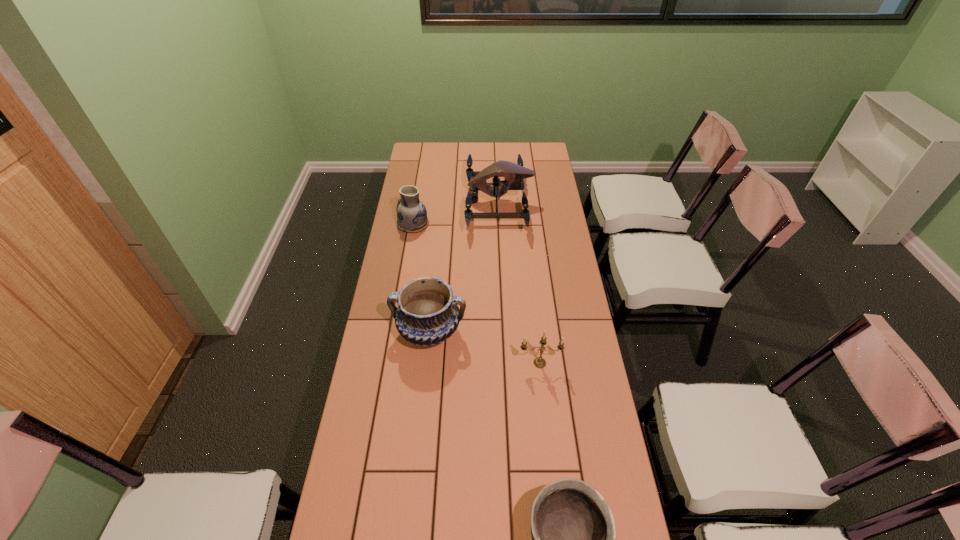
This screenshot has width=960, height=540. In order to click on the third closest object to the farthest pottery in this screenshot , I will do `click(539, 362)`.

Image resolution: width=960 pixels, height=540 pixels. Find the location of `the fourth closest object to the drone`. the fourth closest object to the drone is located at coordinates (573, 531).

Identify which pottery is located as the second nearest to the second farthest pottery. Please provide its 2D coordinates. Your answer should be formatted as a tuple, i.e. [(x, y)], where the tuple contains the x and y coordinates of a point satisfying the conditions above.

[(573, 531)]

The image size is (960, 540). In order to click on the second closest pottery to the second nearest pottery in this screenshot , I will do point(573,531).

The image size is (960, 540). Identify the location of vacant area that satisfies the following two spatial constraints: 1. on the front-facing side of the drone; 2. on the back side of the candle. tap(507, 363).

Where is `free space that satisfies the following two spatial constraints: 1. on the front-facing side of the drone; 2. on the front side of the farthest pottery`? This screenshot has width=960, height=540. free space that satisfies the following two spatial constraints: 1. on the front-facing side of the drone; 2. on the front side of the farthest pottery is located at coordinates (500, 224).

I want to click on free location that satisfies the following two spatial constraints: 1. on the front side of the second farthest pottery; 2. on the left side of the farthest pottery, so click(x=395, y=331).